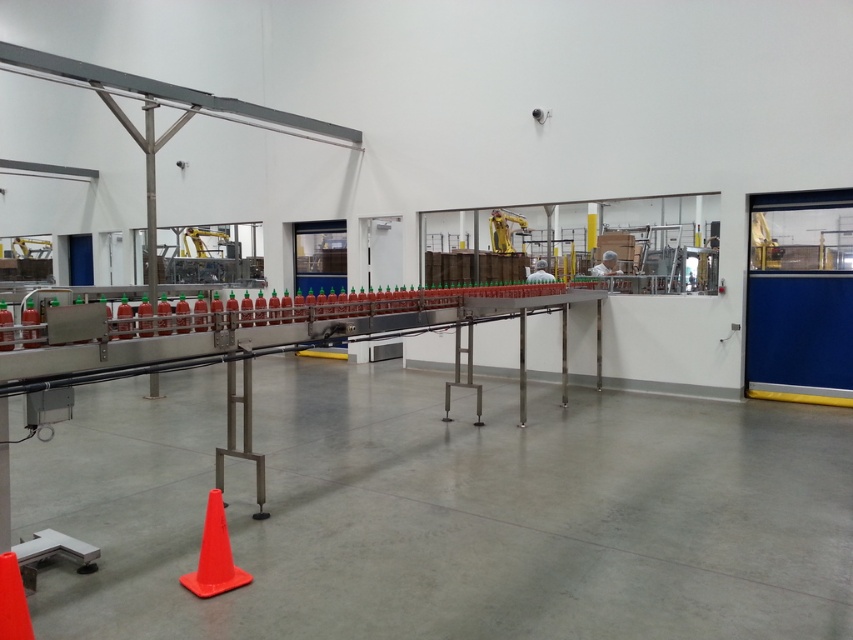
Question: Does orange matte traffic cone at lower left have a smaller size compared to orange matte traffic cone at center?

Choices:
 (A) yes
 (B) no

Answer: (B)

Question: Where is orange matte traffic cone at lower left located in relation to orange matte traffic cone at center in the image?

Choices:
 (A) left
 (B) right

Answer: (B)

Question: Does orange matte traffic cone at lower left have a lesser width compared to orange matte traffic cone at center?

Choices:
 (A) yes
 (B) no

Answer: (B)